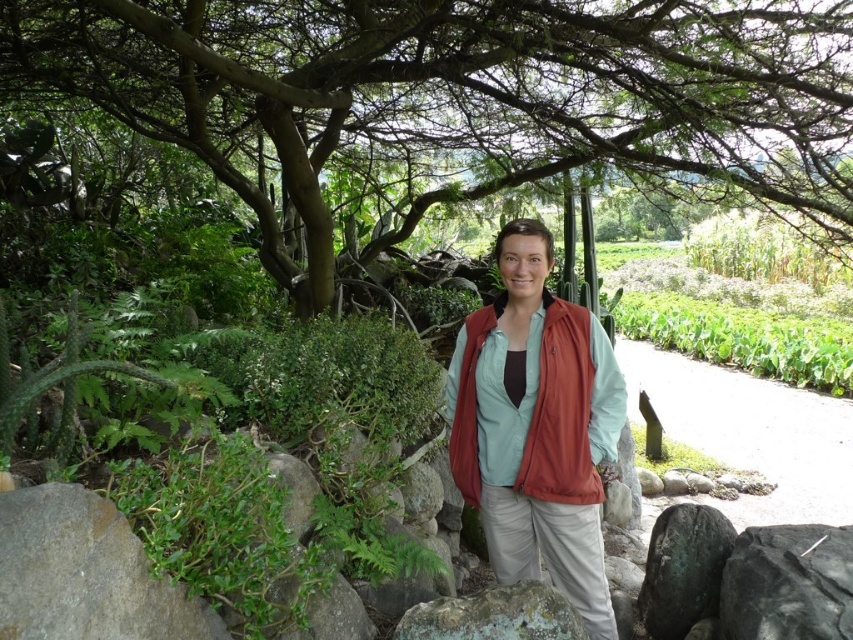
Question: Which is farther from the white gravel path at lower right?

Choices:
 (A) black rock at lower right
 (B) lichen-covered rock at lower center
 (C) matte orange vest at center
 (D) gray rough rock at lower left

Answer: (D)

Question: Can you confirm if white gravel path at lower right is positioned to the right of black rock at lower right?

Choices:
 (A) yes
 (B) no

Answer: (A)

Question: Which point is farther to the camera?

Choices:
 (A) (761, 467)
 (B) (28, 515)

Answer: (A)

Question: Which object is positioned farthest from the lichen-covered rock at lower center?

Choices:
 (A) black rock at lower right
 (B) white gravel path at lower right
 (C) gray rough rock at lower left
 (D) matte orange vest at center

Answer: (B)

Question: Is matte orange vest at center closer to the viewer compared to black rock at lower right?

Choices:
 (A) yes
 (B) no

Answer: (B)

Question: Is gray rough rock at lower left above matte orange vest at center?

Choices:
 (A) yes
 (B) no

Answer: (B)